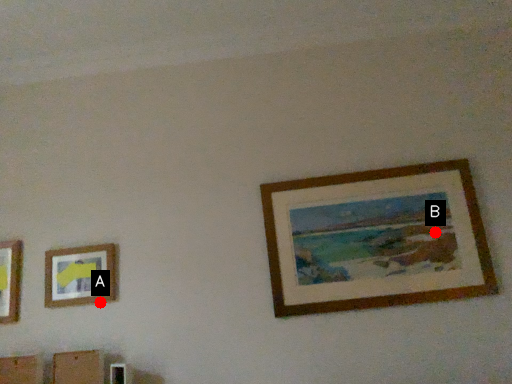
Question: Two points are circled on the image, labeled by A and B beside each circle. Which of the following is the closest to the observer?

Choices:
 (A) A is closer
 (B) B is closer

Answer: (B)